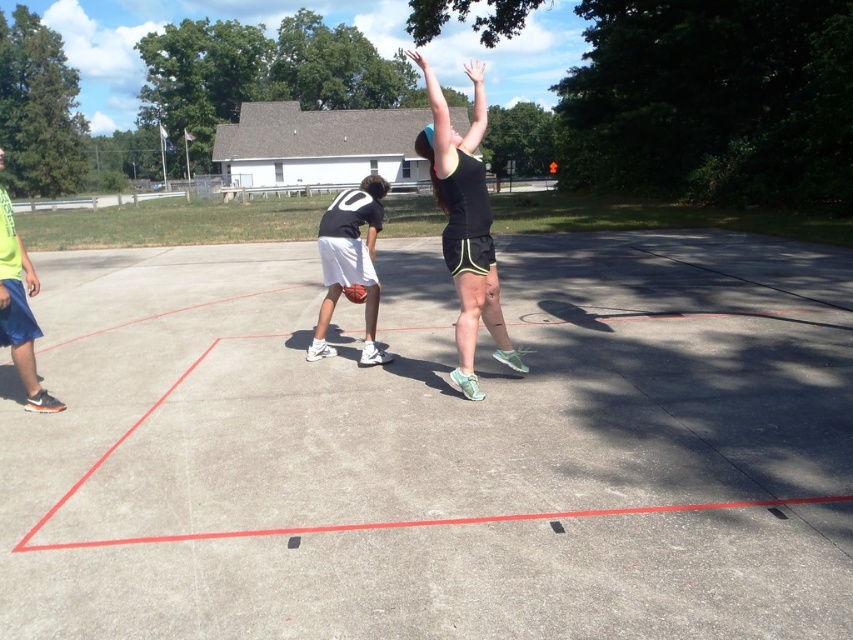
Is concrete at center above glossy orange basketball at center?

No.

At what (x,y) coordinates should I click in order to perform the action: click on concrete at center. Please return your answer as a coordinate pair (x, y). The height and width of the screenshot is (640, 853). Looking at the image, I should click on (438, 449).

Who is more distant from viewer, (477, 294) or (372, 292)?

The point (372, 292) is more distant.

Between black matte shorts at center and black matte basketball at center, which one is positioned lower?

black matte basketball at center is below.

From the picture: Who is more forward, (463, 163) or (337, 196)?

Positioned in front is point (463, 163).

The image size is (853, 640). Find the location of `black matte shorts at center`. black matte shorts at center is located at coordinates (466, 227).

Who is more distant from viewer, (485,269) or (19,348)?

Point (485,269)

Is black matte shorts at center shorter than neon green t-shirt at left?

In fact, black matte shorts at center may be taller than neon green t-shirt at left.

This screenshot has width=853, height=640. I want to click on black matte shorts at center, so click(466, 227).